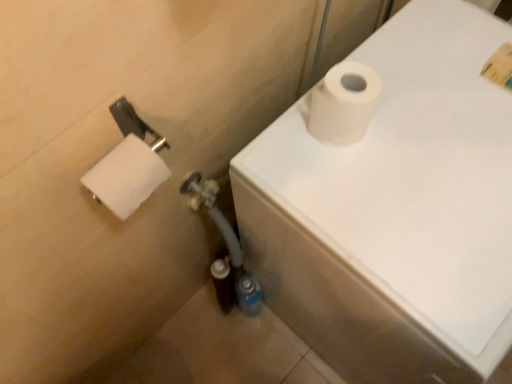
Question: Is white matte toilet paper at upper right, arranged as the 2th toilet paper when viewed from the left, bigger or smaller than white matte toilet paper at upper right?

Choices:
 (A) small
 (B) big

Answer: (A)

Question: From the image's perspective, is white matte toilet paper at upper right, acting as the first toilet paper starting from the right, above or below white matte toilet paper at upper right?

Choices:
 (A) below
 (B) above

Answer: (B)

Question: Which object is positioned farthest from the white matte toilet paper at upper right?

Choices:
 (A) white matte toilet paper at left, which is the 2th toilet paper from right to left
 (B) white matte toilet paper at upper right, acting as the first toilet paper starting from the right

Answer: (A)

Question: Which of these objects is positioned farthest from the white matte toilet paper at upper right, arranged as the 2th toilet paper when viewed from the left?

Choices:
 (A) white matte toilet paper at upper right
 (B) white matte toilet paper at left, arranged as the first toilet paper when viewed from the left

Answer: (B)